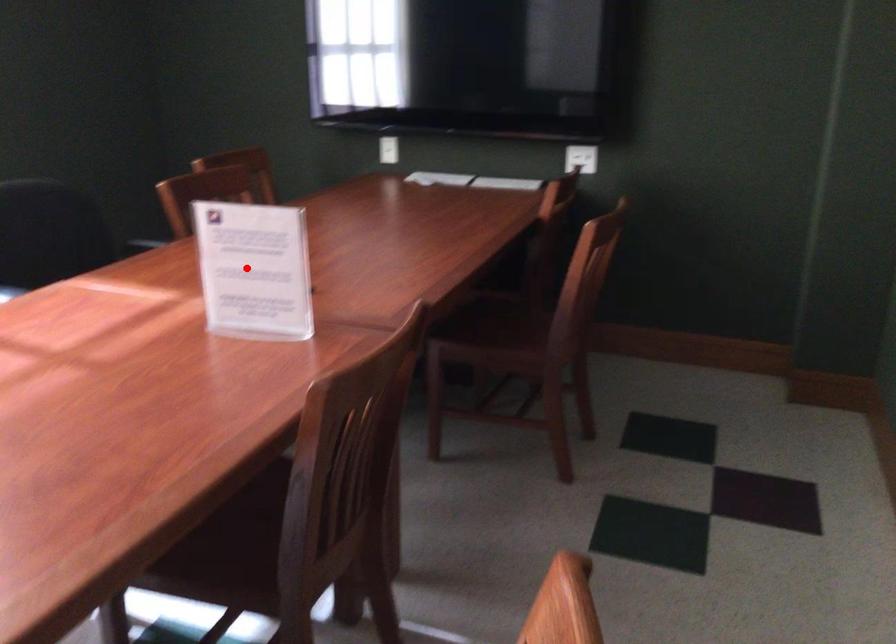
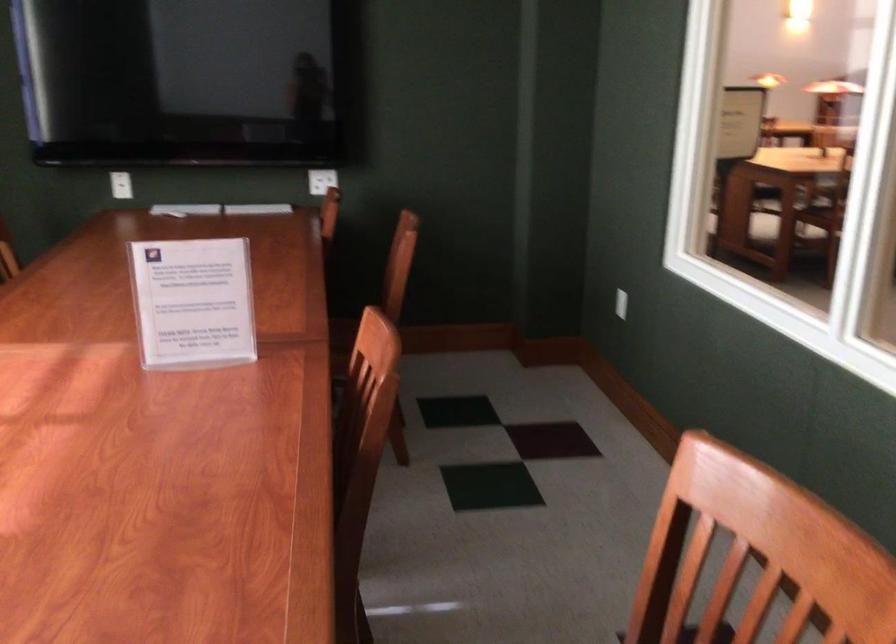
Locate, in the second image, the point that corresponds to the highlighted location in the first image.

(193, 303)